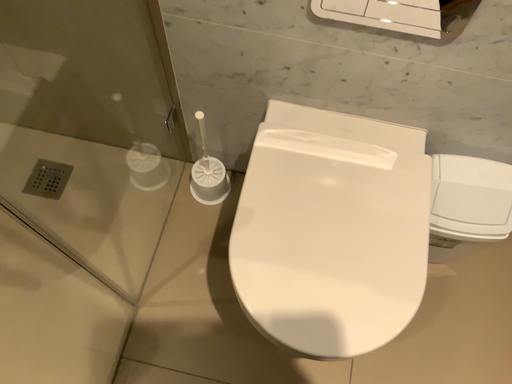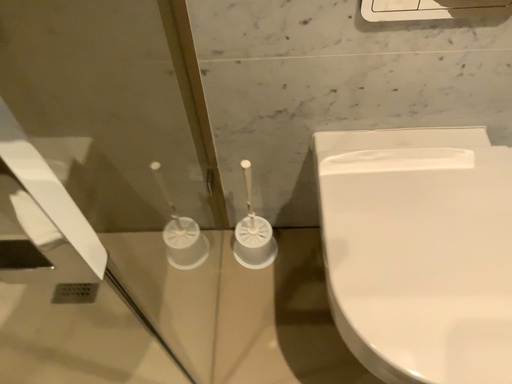
Question: How did the camera likely rotate when shooting the video?

Choices:
 (A) rotated downward
 (B) rotated upward

Answer: (B)